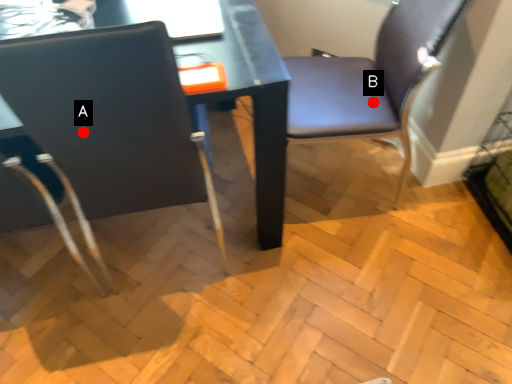
Question: Two points are circled on the image, labeled by A and B beside each circle. Which point appears farthest from the camera in this image?

Choices:
 (A) A is further
 (B) B is further

Answer: (B)